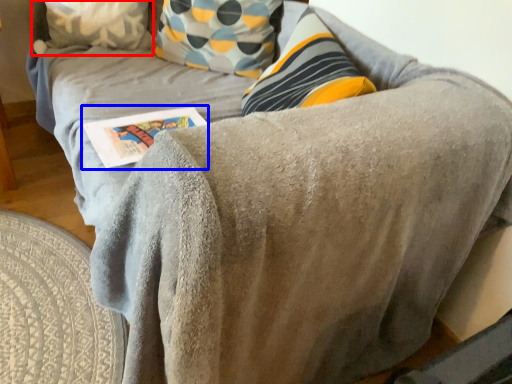
Question: Which of the following is the closest to the observer, pillow (highlighted by a red box) or paperback book (highlighted by a blue box)?

Choices:
 (A) pillow
 (B) paperback book

Answer: (B)